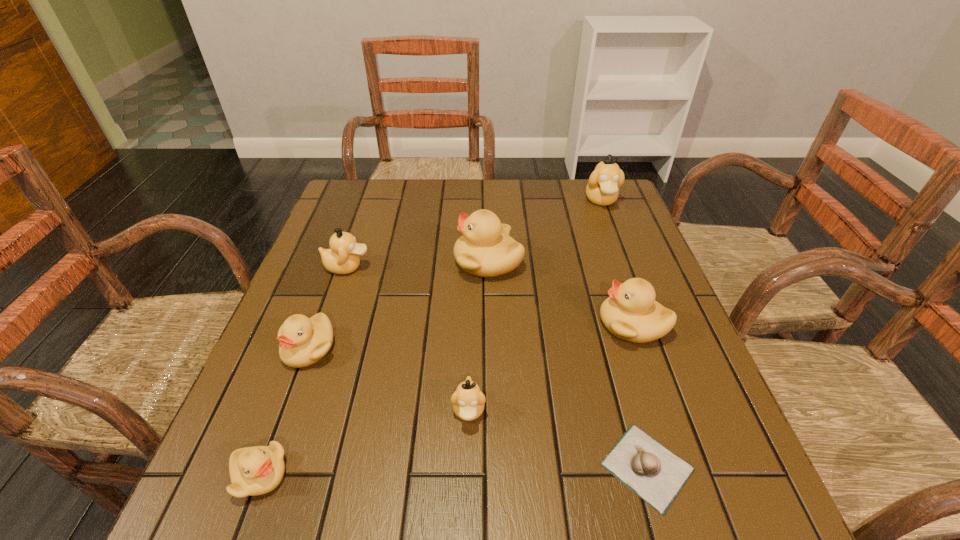
Locate an element on the screen. The image size is (960, 540). the biggest tan duckling is located at coordinates (602, 189).

Identify the location of the farthest object. The width and height of the screenshot is (960, 540). (602, 189).

At what (x,y) coordinates should I click in order to perform the action: click on the third yellow duckling from left to right. Please return your answer as a coordinate pair (x, y). This screenshot has width=960, height=540. Looking at the image, I should click on (485, 249).

Find the location of a particular element. Image resolution: width=960 pixels, height=540 pixels. the biggest yellow duckling is located at coordinates (485, 249).

The image size is (960, 540). Find the location of `the second biggest yellow duckling`. the second biggest yellow duckling is located at coordinates click(x=631, y=313).

In order to click on the second smallest tan duckling in this screenshot , I will do `click(343, 256)`.

Image resolution: width=960 pixels, height=540 pixels. In order to click on the leftmost tan duckling in this screenshot , I will do `click(343, 256)`.

You are a GUI agent. You are given a task and a screenshot of the screen. Output one action in this format:
    pyautogui.click(x=<x>, y=<y>)
    Task: Click on the second smallest yellow duckling
    Image resolution: width=960 pixels, height=540 pixels.
    Given the screenshot: What is the action you would take?
    pyautogui.click(x=303, y=341)

Image resolution: width=960 pixels, height=540 pixels. In order to click on the second nearest duckling in this screenshot , I will do `click(468, 401)`.

At what (x,y) coordinates should I click in order to perform the action: click on the nearest tan duckling. Please return your answer as a coordinate pair (x, y). The height and width of the screenshot is (540, 960). Looking at the image, I should click on (468, 401).